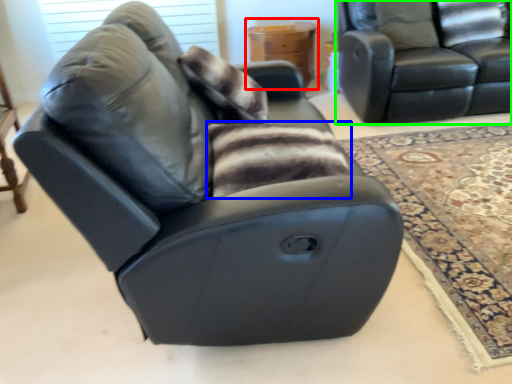
Question: Estimate the real-world distances between objects in this image. Which object is farther from table (highlighted by a red box), blanket (highlighted by a blue box) or studio couch (highlighted by a green box)?

Choices:
 (A) blanket
 (B) studio couch

Answer: (A)